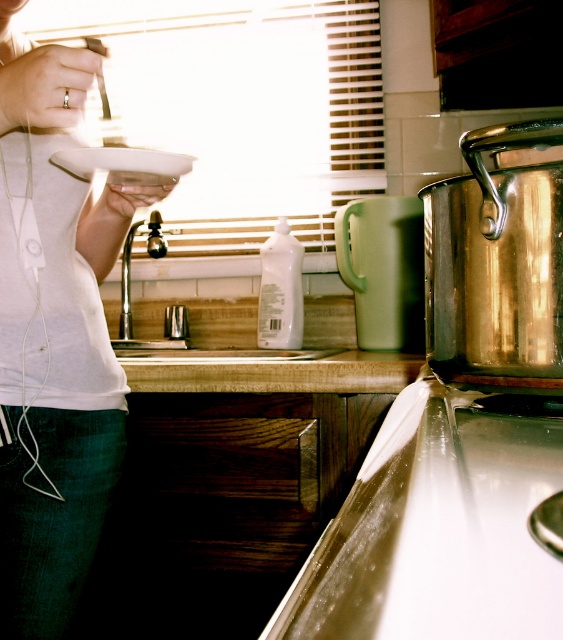
Does white matte shirt at upper left have a lesser height compared to white glossy sink at center?

Incorrect, white matte shirt at upper left's height does not fall short of white glossy sink at center's.

The width and height of the screenshot is (563, 640). Describe the element at coordinates (52, 339) in the screenshot. I see `white matte shirt at upper left` at that location.

Image resolution: width=563 pixels, height=640 pixels. What are the coordinates of `white matte shirt at upper left` in the screenshot? It's located at (52, 339).